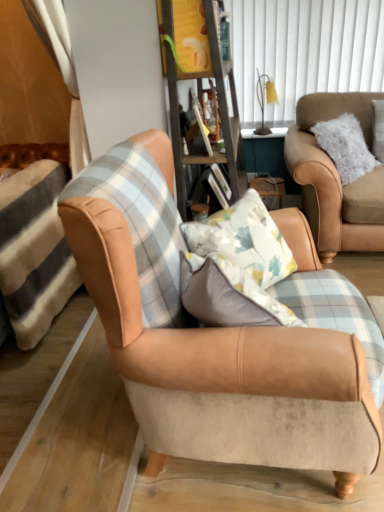
Question: Is white vertical blinds at upper center far from yellow fabric lampshade at upper center?

Choices:
 (A) yes
 (B) no

Answer: (B)

Question: Is white vertical blinds at upper center not inside yellow fabric lampshade at upper center?

Choices:
 (A) yes
 (B) no

Answer: (A)

Question: Does white vertical blinds at upper center have a larger size compared to yellow fabric lampshade at upper center?

Choices:
 (A) no
 (B) yes

Answer: (B)

Question: Is white vertical blinds at upper center to the right of yellow fabric lampshade at upper center from the viewer's perspective?

Choices:
 (A) yes
 (B) no

Answer: (A)

Question: Considering the relative sizes of white vertical blinds at upper center and yellow fabric lampshade at upper center in the image provided, is white vertical blinds at upper center wider than yellow fabric lampshade at upper center?

Choices:
 (A) yes
 (B) no

Answer: (B)

Question: In the image, is wooden bookshelf at center on the left side or the right side of tan suede armchair at center, positioned as the 1th chair in left-to-right order?

Choices:
 (A) left
 (B) right

Answer: (B)

Question: Choose the correct answer: Is wooden bookshelf at center inside tan suede armchair at center, positioned as the 1th chair in left-to-right order, or outside it?

Choices:
 (A) outside
 (B) inside

Answer: (A)

Question: Considering the positions of wooden bookshelf at center and tan suede armchair at center, the 1th chair when ordered from front to back, in the image, is wooden bookshelf at center wider or thinner than tan suede armchair at center, the 1th chair when ordered from front to back,?

Choices:
 (A) thin
 (B) wide

Answer: (A)

Question: From a real-world perspective, is wooden bookshelf at center above or below tan suede armchair at center, positioned as the 1th chair in left-to-right order?

Choices:
 (A) above
 (B) below

Answer: (A)

Question: Is wooden bookshelf at center taller or shorter than suede tan armchair at right, placed as the 1th chair when sorted from right to left?

Choices:
 (A) tall
 (B) short

Answer: (A)

Question: From a real-world perspective, is wooden bookshelf at center physically located above or below suede tan armchair at right, the second chair when ordered from left to right?

Choices:
 (A) below
 (B) above

Answer: (B)

Question: Is wooden bookshelf at center in front of or behind suede tan armchair at right, placed as the 1th chair when sorted from right to left, in the image?

Choices:
 (A) behind
 (B) front

Answer: (B)

Question: From the image's perspective, relative to suede tan armchair at right, the 1th chair from the back, is wooden bookshelf at center above or below?

Choices:
 (A) above
 (B) below

Answer: (A)

Question: Is tan suede armchair at center, the 2th chair when ordered from right to left, wider or thinner than white vertical blinds at upper center?

Choices:
 (A) wide
 (B) thin

Answer: (A)

Question: From a real-world perspective, is tan suede armchair at center, the 1th chair when ordered from front to back, positioned above or below white vertical blinds at upper center?

Choices:
 (A) above
 (B) below

Answer: (B)